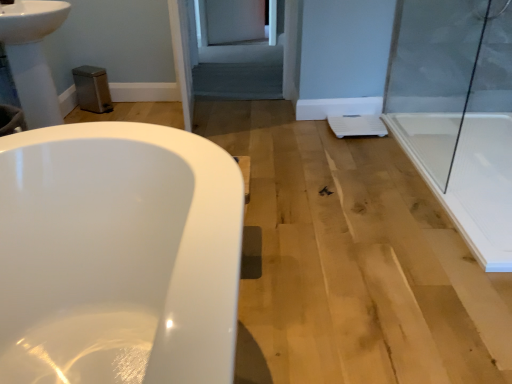
Question: Considering the positions of gray fabric screen door at center and white glossy sink at upper left in the image, is gray fabric screen door at center bigger or smaller than white glossy sink at upper left?

Choices:
 (A) small
 (B) big

Answer: (B)

Question: Is point (279, 77) positioned closer to the camera than point (4, 36)?

Choices:
 (A) farther
 (B) closer

Answer: (A)

Question: Which of these objects is positioned farthest from the silver metallic faucet at upper left?

Choices:
 (A) gray fabric screen door at center
 (B) white glossy sink at upper left
 (C) transparent glass shower door at right

Answer: (C)

Question: Which object is positioned farthest from the gray fabric screen door at center?

Choices:
 (A) transparent glass shower door at right
 (B) silver metallic faucet at upper left
 (C) white glossy sink at upper left

Answer: (B)